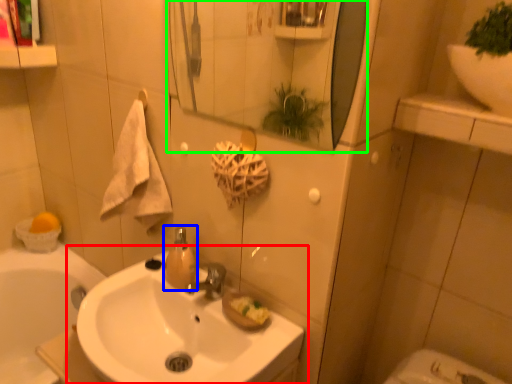
Question: Which object is positioned closest to sink (highlighted by a red box)? Select from soap dispenser (highlighted by a blue box) and mirror (highlighted by a green box).

Choices:
 (A) soap dispenser
 (B) mirror

Answer: (A)